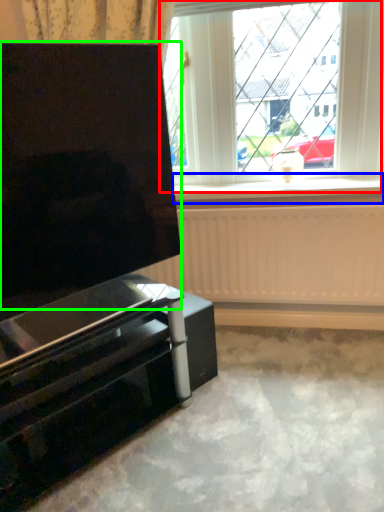
Question: Which object is positioned farthest from window (highlighted by a red box)? Select from window sill (highlighted by a blue box) and screen (highlighted by a green box).

Choices:
 (A) window sill
 (B) screen

Answer: (B)